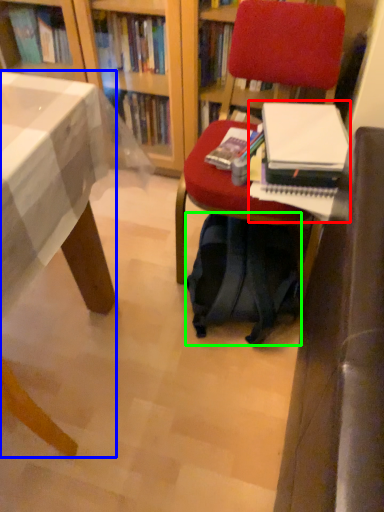
Question: Estimate the real-world distances between objects in this image. Which object is closer to paperback book (highlighted by a red box), desk (highlighted by a blue box) or backpack (highlighted by a green box)?

Choices:
 (A) desk
 (B) backpack

Answer: (B)